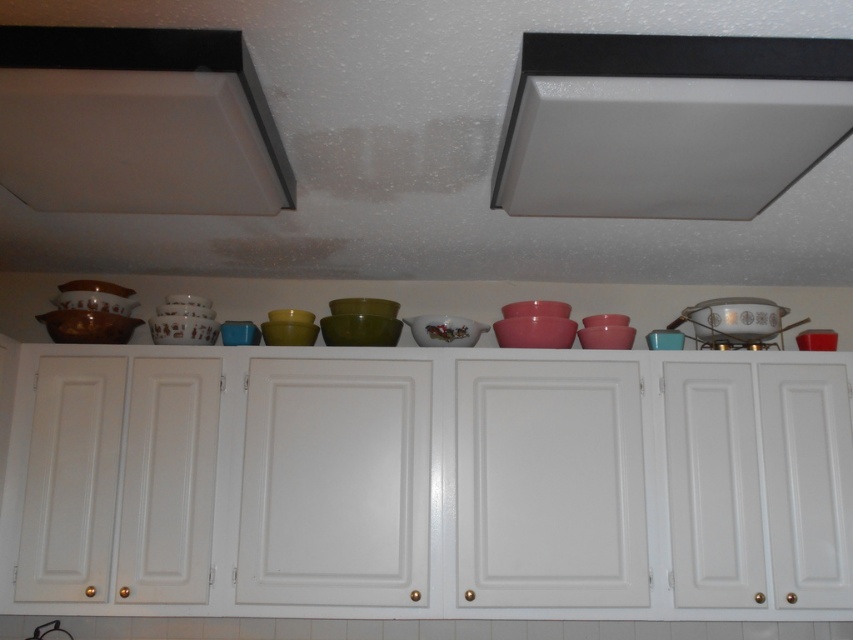
You are a kitchen designer assessing the layout. You see the white matte exhaust hood at upper center and the matte white exhaust hood at upper left. Which one is taller?

The white matte exhaust hood at upper center is taller than the matte white exhaust hood at upper left.

You are a kitchen designer planning to install a new appliance that requires a minimum of 80 centimeters of space between two existing exhaust hoods. Based on the scene, can the new appliance be placed between the white matte exhaust hood at upper center and the matte white exhaust hood at upper left?

The white matte exhaust hood at upper center is 91.17 centimeters from the matte white exhaust hood at upper left, which exceeds the required 80 centimeters. Therefore, the new appliance can be placed between them.

You are a kitchen designer planning to install a new microwave above the white matte exhaust hood at upper center. The microwave requires a minimum clearance of 15 cm from the nearest edge of the exhaust hood. Based on the coordinates provided, can you determine if there is enough space to install the microwave?

The white matte exhaust hood at upper center is located at coordinates point (666, 124). However, without knowing the dimensions of the exhaust hood or the available space around it, it is impossible to determine if there is enough clearance for the microwave installation.